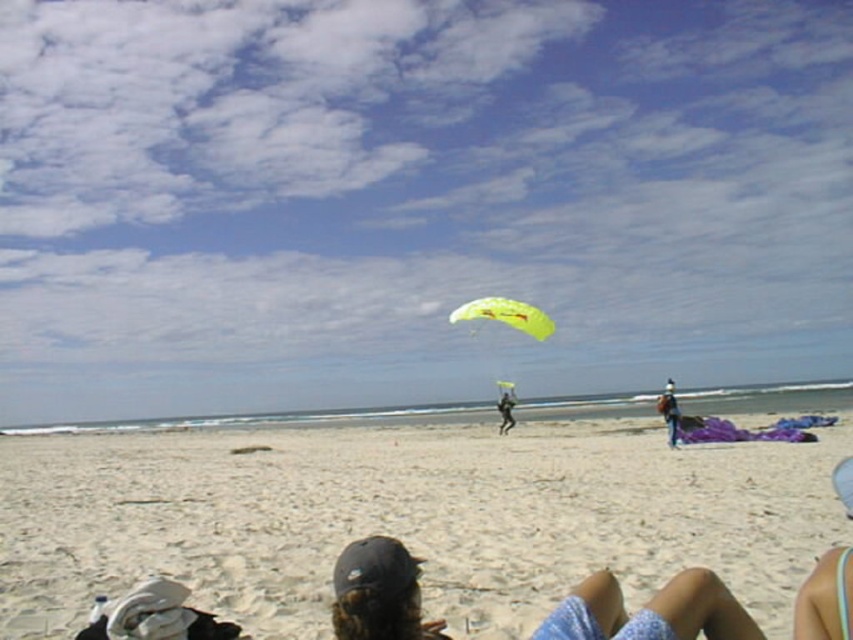
Between multicolored swimsuit at lower right and blue denim jeans at lower right, which one appears on the right side from the viewer's perspective?

From the viewer's perspective, blue denim jeans at lower right appears more on the right side.

What do you see at coordinates (827, 598) in the screenshot?
I see `multicolored swimsuit at lower right` at bounding box center [827, 598].

Locate an element on the screen. multicolored swimsuit at lower right is located at coordinates (827, 598).

Find the location of a particular element. multicolored swimsuit at lower right is located at coordinates (827, 598).

Who is shorter, neon yellow fabric parachute at center or blue denim jeans at lower right?

blue denim jeans at lower right

Does neon yellow fabric parachute at center have a lesser height compared to blue denim jeans at lower right?

No.

The height and width of the screenshot is (640, 853). Find the location of `neon yellow fabric parachute at center`. neon yellow fabric parachute at center is located at coordinates (506, 316).

Does transparent yellow parachute at center have a lesser width compared to multicolored swimsuit at lower right?

No, transparent yellow parachute at center is not thinner than multicolored swimsuit at lower right.

Between transparent yellow parachute at center and multicolored swimsuit at lower right, which one has less height?

Standing shorter between the two is multicolored swimsuit at lower right.

Describe the element at coordinates (415, 198) in the screenshot. I see `transparent yellow parachute at center` at that location.

The width and height of the screenshot is (853, 640). What are the coordinates of `transparent yellow parachute at center` in the screenshot? It's located at (415, 198).